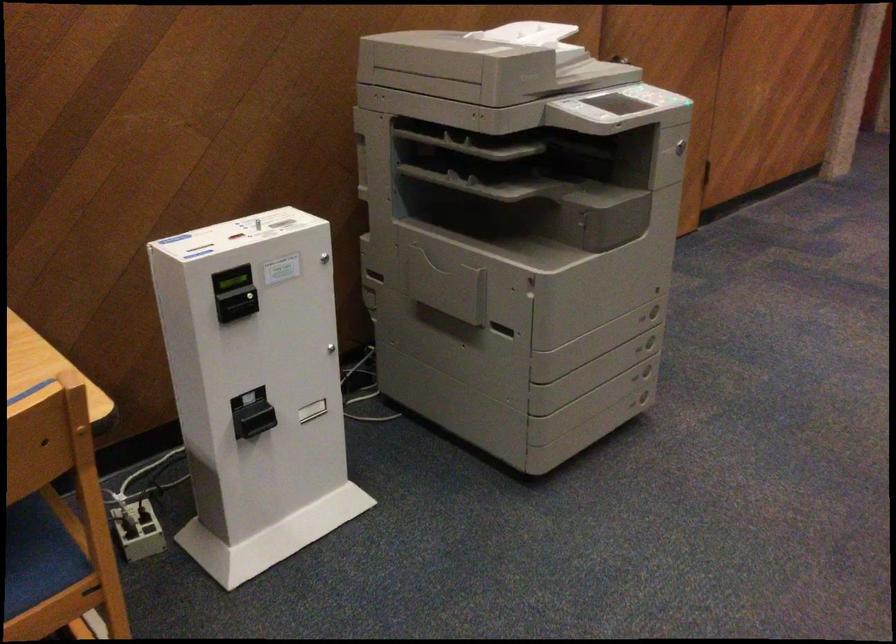
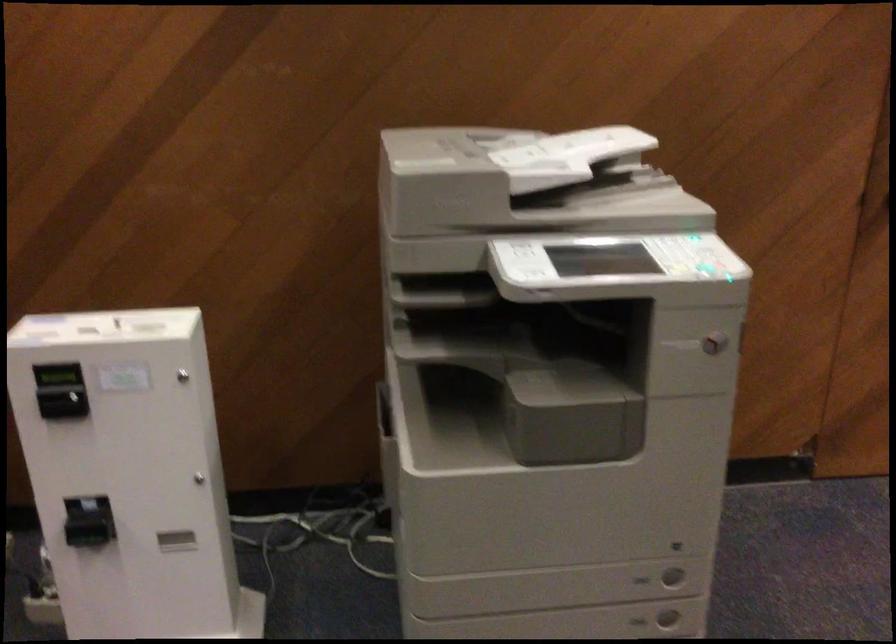
Find the pixel in the second image that matches pixel 314 261 in the first image.

(183, 375)